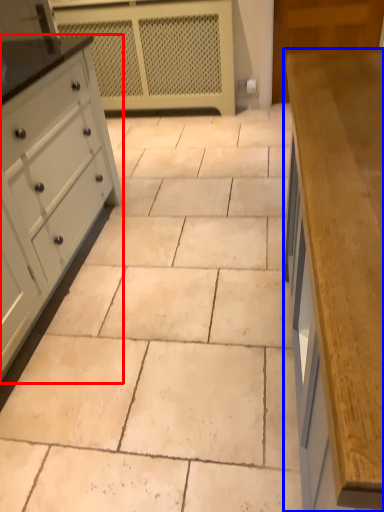
Question: Among these objects, which one is nearest to the camera, chest of drawers (highlighted by a red box) or countertop (highlighted by a blue box)?

Choices:
 (A) chest of drawers
 (B) countertop

Answer: (B)